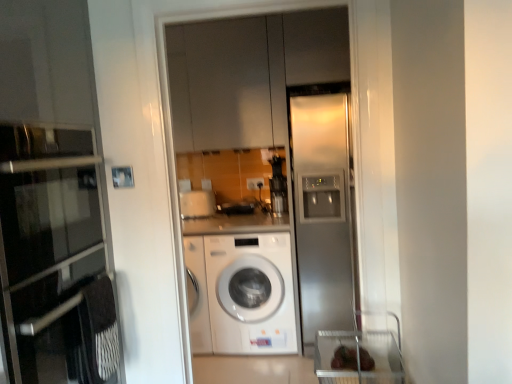
Question: From a real-world perspective, is satin silver refrigerator at center located beneath matte glass oven at left?

Choices:
 (A) no
 (B) yes

Answer: (B)

Question: Does satin silver refrigerator at center contain matte glass oven at left?

Choices:
 (A) no
 (B) yes

Answer: (A)

Question: Are satin silver refrigerator at center and matte glass oven at left making contact?

Choices:
 (A) yes
 (B) no

Answer: (B)

Question: Is satin silver refrigerator at center shorter than matte glass oven at left?

Choices:
 (A) no
 (B) yes

Answer: (A)

Question: Is satin silver refrigerator at center not near matte glass oven at left?

Choices:
 (A) no
 (B) yes

Answer: (B)

Question: Based on their positions, is stainless steel refrigerator at right located to the left or right of satin silver refrigerator at center?

Choices:
 (A) left
 (B) right

Answer: (B)

Question: Is stainless steel refrigerator at right bigger or smaller than satin silver refrigerator at center?

Choices:
 (A) small
 (B) big

Answer: (B)

Question: Considering the positions of stainless steel refrigerator at right and satin silver refrigerator at center in the image, is stainless steel refrigerator at right wider or thinner than satin silver refrigerator at center?

Choices:
 (A) wide
 (B) thin

Answer: (A)

Question: Would you say stainless steel refrigerator at right is inside or outside satin silver refrigerator at center?

Choices:
 (A) inside
 (B) outside

Answer: (B)

Question: From a real-world perspective, relative to white plastic electric outlet at center, is satin silver refrigerator at center vertically above or below?

Choices:
 (A) below
 (B) above

Answer: (B)

Question: Considering the positions of satin silver refrigerator at center and white plastic electric outlet at center in the image, is satin silver refrigerator at center taller or shorter than white plastic electric outlet at center?

Choices:
 (A) tall
 (B) short

Answer: (A)

Question: In terms of width, does satin silver refrigerator at center look wider or thinner when compared to white plastic electric outlet at center?

Choices:
 (A) thin
 (B) wide

Answer: (B)

Question: From the image's perspective, is satin silver refrigerator at center above or below white plastic electric outlet at center?

Choices:
 (A) below
 (B) above

Answer: (A)

Question: Is matte glass oven at left situated inside satin silver refrigerator at center or outside?

Choices:
 (A) outside
 (B) inside

Answer: (A)

Question: Looking at their shapes, would you say matte glass oven at left is wider or thinner than satin silver refrigerator at center?

Choices:
 (A) wide
 (B) thin

Answer: (A)